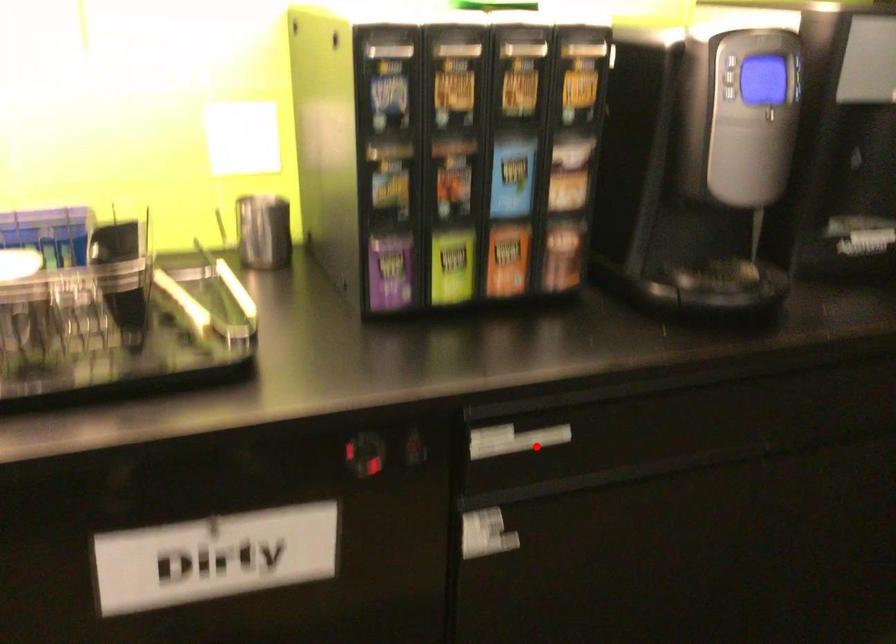
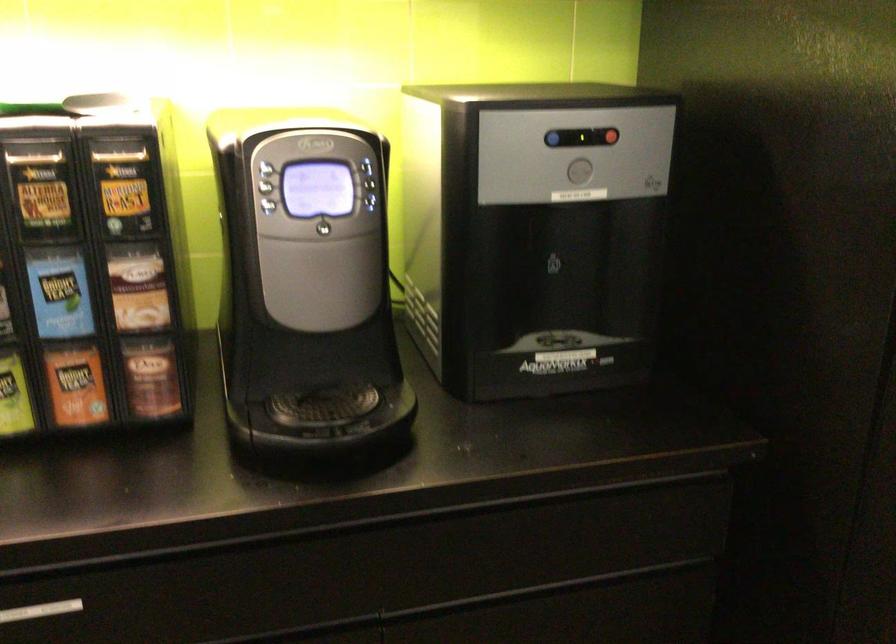
Question: A red point is marked in image1. In image2, is the corresponding 3D point closer to the camera or farther? Reply with the corresponding letter.

Choices:
 (A) The corresponding 3D point is closer.
 (B) The corresponding 3D point is farther.

Answer: (A)